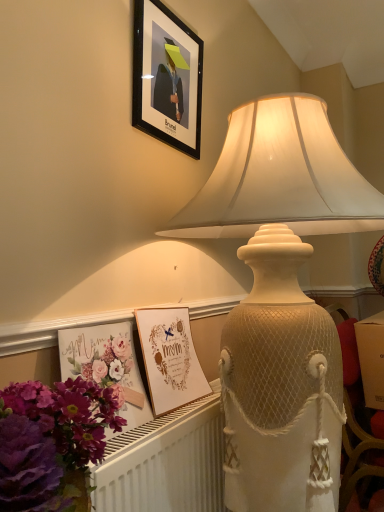
What are the coordinates of `vacant space to the right of floral paper postcard at lower left, which ranks as the 1th postcard in front-to-back order` in the screenshot? It's located at (162, 425).